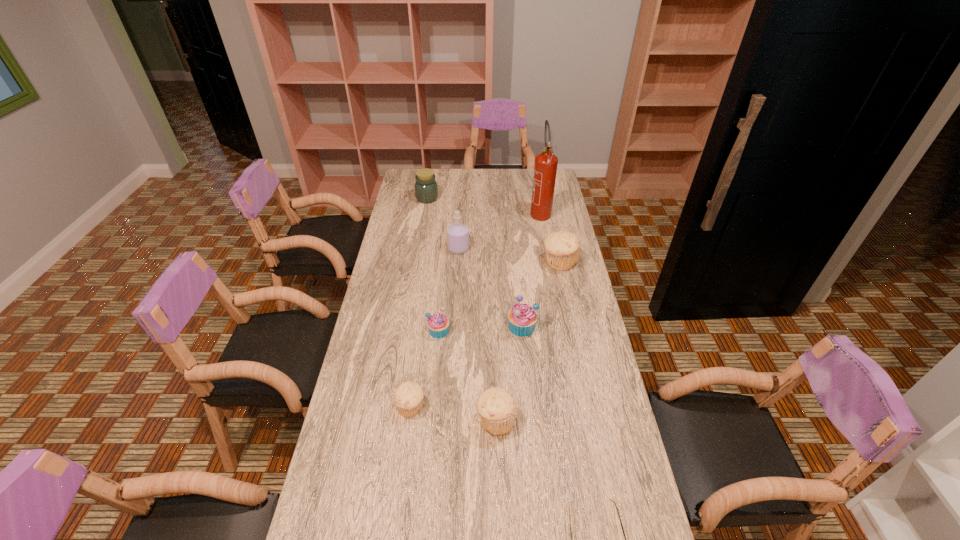
I want to click on muffin present at the left edge, so click(x=408, y=396).

Locate an element on the screen. fire extinguisher that is at the right edge is located at coordinates (545, 168).

Identify the location of muffin that is positioned at the right edge. This screenshot has height=540, width=960. (562, 248).

Image resolution: width=960 pixels, height=540 pixels. Find the location of `vacant space at the far edge of the desktop`. vacant space at the far edge of the desktop is located at coordinates (455, 173).

Identify the location of vacant region at the left edge of the desktop. The image size is (960, 540). (391, 281).

What are the coordinates of `vacant region at the right edge of the desktop` in the screenshot? It's located at (560, 213).

You are a GUI agent. You are given a task and a screenshot of the screen. Output one action in this format:
    pyautogui.click(x=<x>, y=<y>)
    Task: Click on the vacant space at the far left corner of the desktop
    The height and width of the screenshot is (540, 960).
    Given the screenshot: What is the action you would take?
    pyautogui.click(x=415, y=176)

This screenshot has width=960, height=540. In the image, there is a desktop. In order to click on vacant space at the far right corner in this screenshot , I will do `click(528, 180)`.

Locate an element on the screen. vacant area that lies between the eighth shortest object and the green jar is located at coordinates (443, 224).

Image resolution: width=960 pixels, height=540 pixels. Identify the location of vacant space that's between the perfume and the farthest beige muffin. (509, 255).